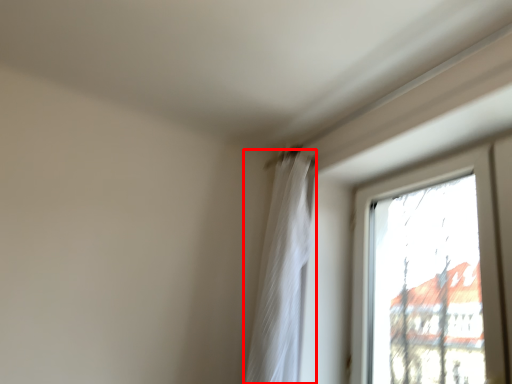
Question: From the image's perspective, considering the relative positions of curtain (annotated by the red box) and window in the image provided, where is curtain (annotated by the red box) located with respect to the staircase?

Choices:
 (A) below
 (B) above

Answer: (B)